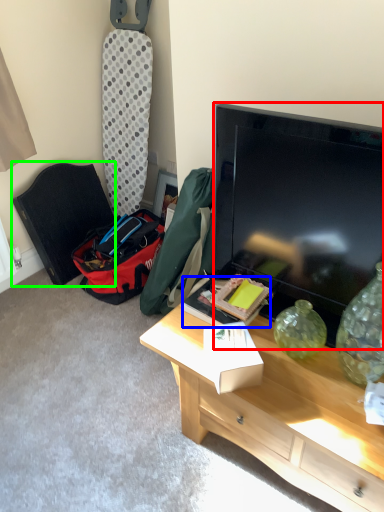
Question: Which object is the farthest from television (highlighted by a red box)? Choose among these: box (highlighted by a blue box) or folding chair (highlighted by a green box).

Choices:
 (A) box
 (B) folding chair

Answer: (B)